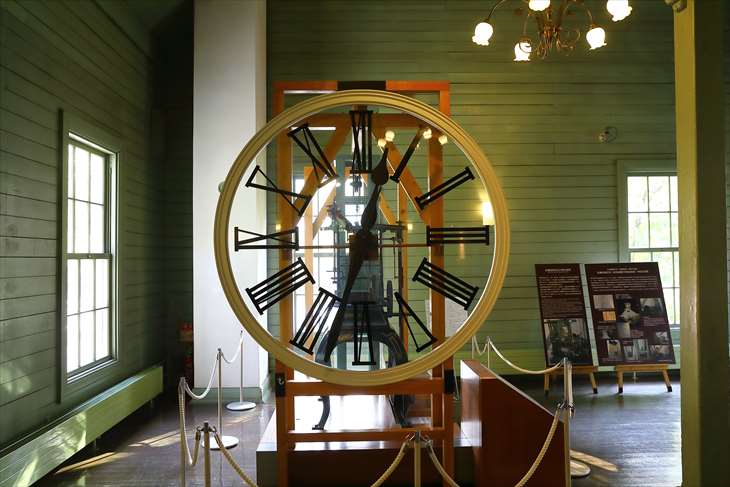
Locate an element on the screen. Image resolution: width=730 pixels, height=487 pixels. clock is located at coordinates (231, 278).